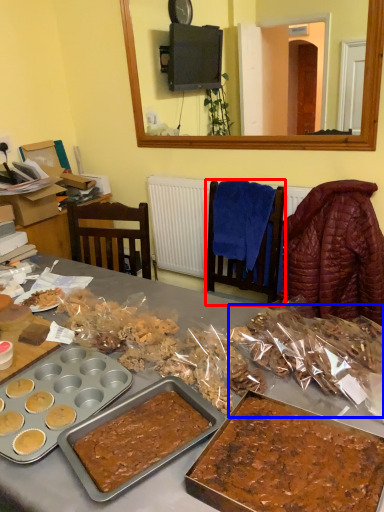
Question: Which of the following is the closest to the observer, chair (highlighted by a red box) or snack (highlighted by a blue box)?

Choices:
 (A) chair
 (B) snack

Answer: (B)